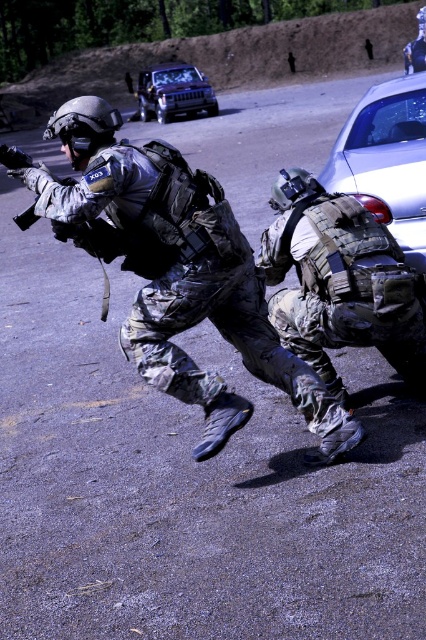
Question: Which object is farther from the camera taking this photo?

Choices:
 (A) camouflage fabric uniform at center
 (B) satin silver car at right
 (C) metallic silver suv at upper center

Answer: (C)

Question: Can you confirm if camouflage fabric uniform at center is positioned above satin silver car at right?

Choices:
 (A) no
 (B) yes

Answer: (A)

Question: Can you confirm if camouflage fabric backpack at lower right is smaller than satin silver car at right?

Choices:
 (A) yes
 (B) no

Answer: (B)

Question: Estimate the real-world distances between objects in this image. Which object is closer to the camouflage fabric uniform at center?

Choices:
 (A) metallic silver suv at upper center
 (B) camouflage fabric backpack at lower right

Answer: (B)

Question: Does satin silver car at right have a larger size compared to metallic silver suv at upper center?

Choices:
 (A) no
 (B) yes

Answer: (A)

Question: Which of the following is the farthest from the observer?

Choices:
 (A) (354, 124)
 (B) (345, 241)
 (C) (195, 292)
 (D) (209, 106)

Answer: (D)